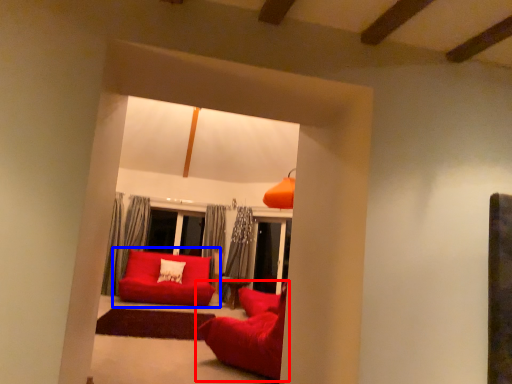
Question: Which point is further to the camera, studio couch (highlighted by a red box) or studio couch (highlighted by a blue box)?

Choices:
 (A) studio couch
 (B) studio couch

Answer: (B)